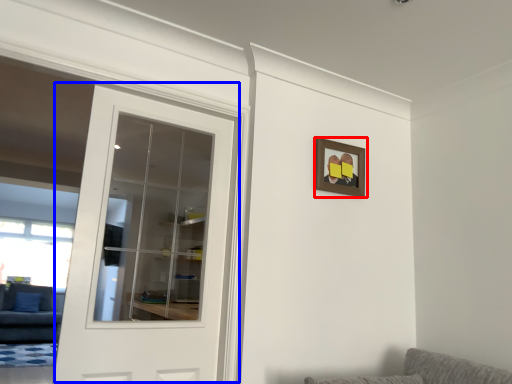
Question: Which object is further to the camera taking this photo, picture frame (highlighted by a red box) or door (highlighted by a blue box)?

Choices:
 (A) picture frame
 (B) door

Answer: (A)